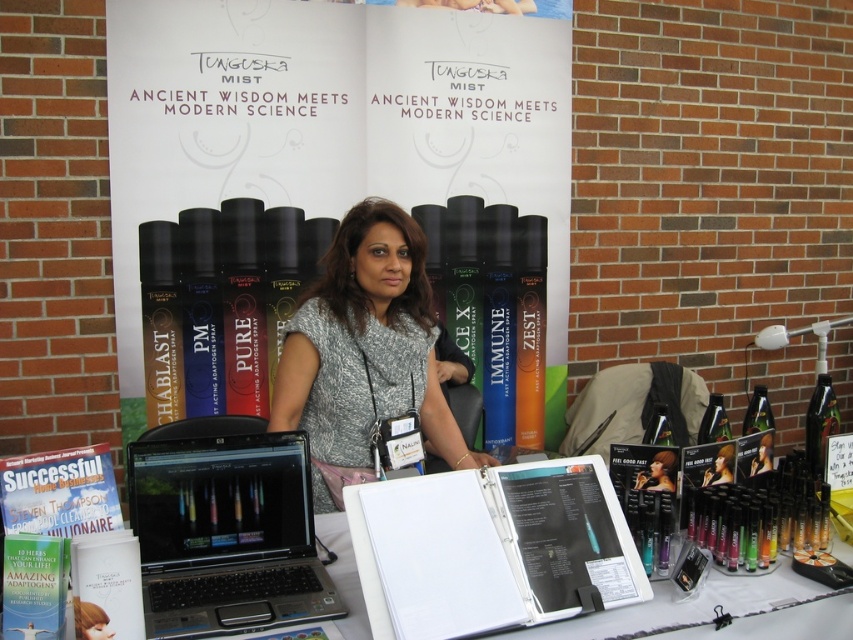
Question: Can you confirm if white paperboard at center is bigger than white paper at center?

Choices:
 (A) yes
 (B) no

Answer: (A)

Question: Based on their relative distances, which object is nearer to the white paper at center?

Choices:
 (A) black plastic laptop at center
 (B) white paperboard at center

Answer: (A)

Question: Is white paperboard at center closer to the viewer compared to matte gray blouse at center?

Choices:
 (A) yes
 (B) no

Answer: (B)

Question: Does matte gray blouse at center have a greater width compared to white paper at center?

Choices:
 (A) yes
 (B) no

Answer: (B)

Question: Which point is closer to the camera?

Choices:
 (A) (312, 563)
 (B) (675, 451)

Answer: (A)

Question: Among these objects, which one is farthest from the camera?

Choices:
 (A) white paper at center
 (B) black plastic laptop at center
 (C) matte gray blouse at center

Answer: (C)